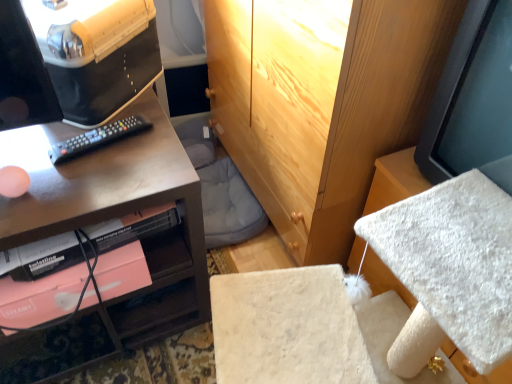
Question: From a real-world perspective, does black plastic remote at left stand above matte black desk at left?

Choices:
 (A) no
 (B) yes

Answer: (B)

Question: Can you confirm if black plastic remote at left is positioned to the left of matte black desk at left?

Choices:
 (A) no
 (B) yes

Answer: (A)

Question: Is black plastic remote at left facing away from matte black desk at left?

Choices:
 (A) no
 (B) yes

Answer: (B)

Question: Could matte black desk at left be considered to be inside black plastic remote at left?

Choices:
 (A) yes
 (B) no

Answer: (B)

Question: Does black plastic remote at left touch matte black desk at left?

Choices:
 (A) yes
 (B) no

Answer: (B)

Question: Choose the correct answer: Is matte black monitor at upper left inside matte black desk at left or outside it?

Choices:
 (A) outside
 (B) inside

Answer: (A)

Question: From a real-world perspective, relative to matte black desk at left, is matte black monitor at upper left vertically above or below?

Choices:
 (A) below
 (B) above

Answer: (B)

Question: Based on their sizes in the image, would you say matte black monitor at upper left is bigger or smaller than matte black desk at left?

Choices:
 (A) big
 (B) small

Answer: (B)

Question: Does point (145, 44) appear closer or farther from the camera than point (164, 167)?

Choices:
 (A) farther
 (B) closer

Answer: (A)

Question: Considering the relative positions of matte black monitor at right and black plastic remote at left in the image provided, is matte black monitor at right to the left or to the right of black plastic remote at left?

Choices:
 (A) right
 (B) left

Answer: (A)

Question: In terms of width, does matte black monitor at right look wider or thinner when compared to black plastic remote at left?

Choices:
 (A) thin
 (B) wide

Answer: (B)

Question: Does point (480, 122) appear closer or farther from the camera than point (95, 145)?

Choices:
 (A) closer
 (B) farther

Answer: (A)

Question: Looking at the image, does matte black monitor at right seem bigger or smaller compared to black plastic remote at left?

Choices:
 (A) big
 (B) small

Answer: (A)

Question: Based on their sizes in the image, would you say matte black monitor at upper left is bigger or smaller than matte black monitor at right?

Choices:
 (A) big
 (B) small

Answer: (B)

Question: Is matte black monitor at upper left inside the boundaries of matte black monitor at right, or outside?

Choices:
 (A) outside
 (B) inside

Answer: (A)